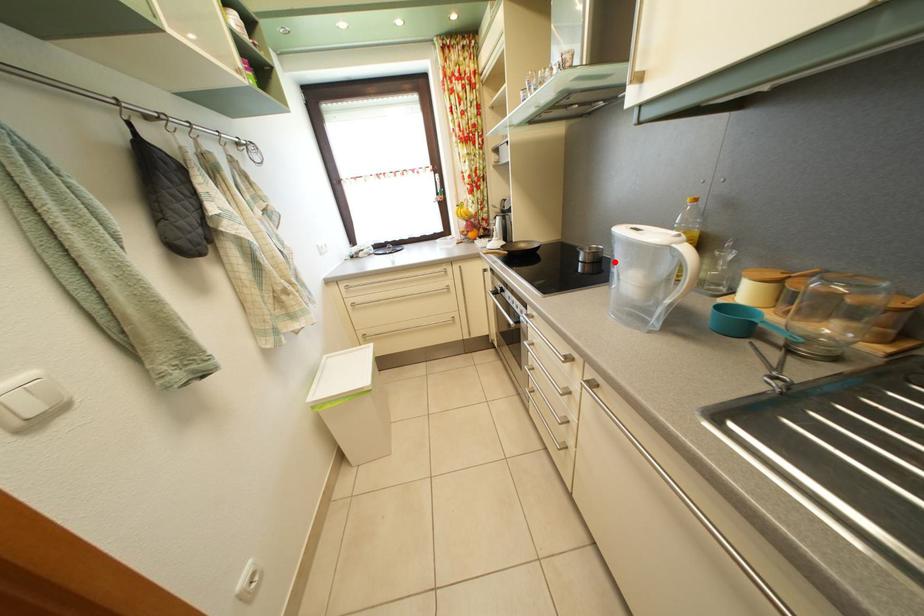
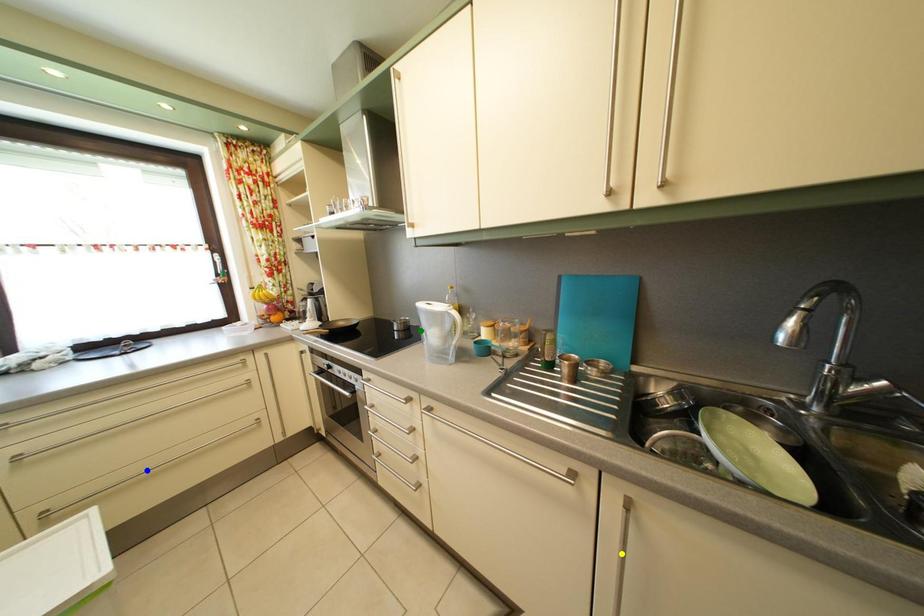
Question: I am providing you with two images of the same scene from different viewpoints. A red point is marked on the first image. You are given multiple points on the second image. Which point in image 2 represents the same 3d spot as the red point in image 1?

Choices:
 (A) blue point
 (B) yellow point
 (C) green point

Answer: (C)